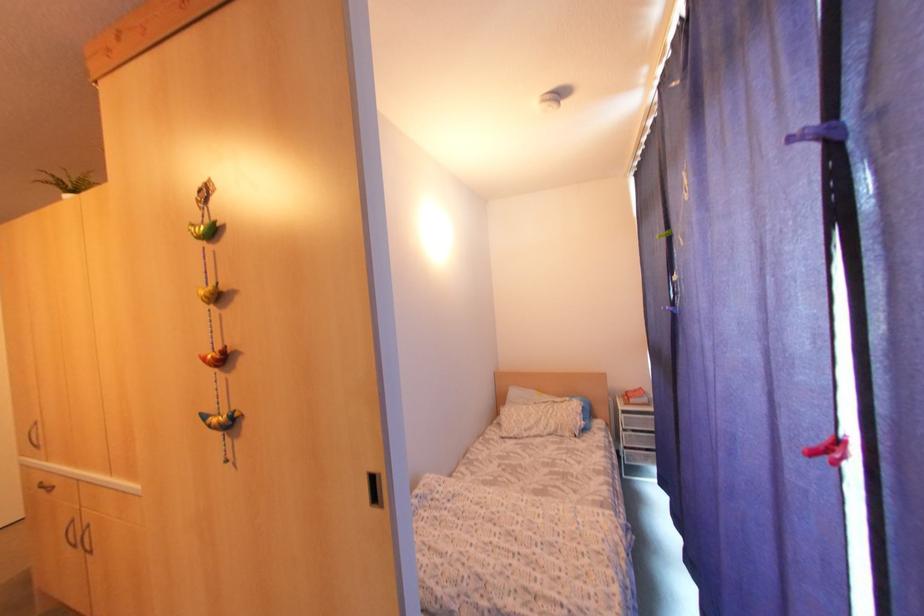
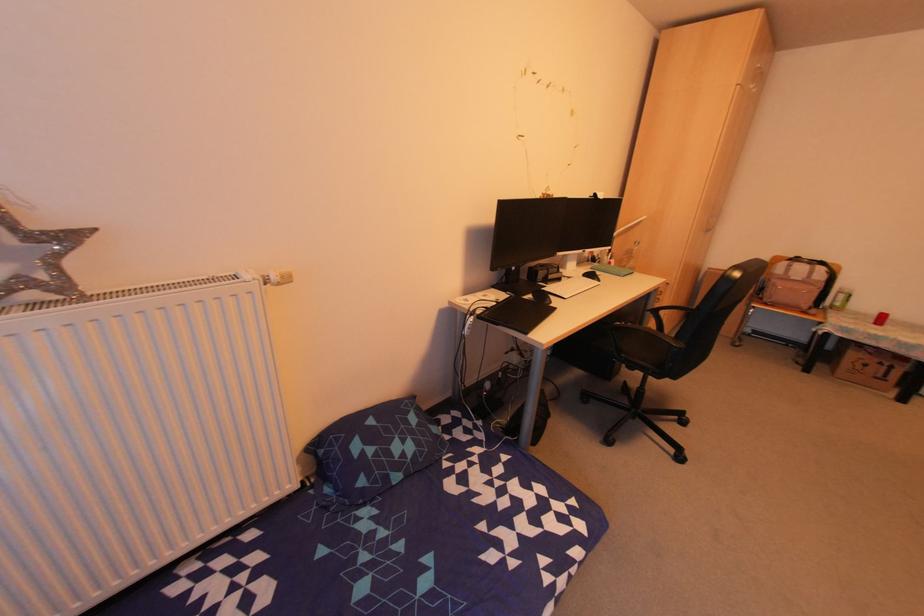
How did the camera likely rotate?

The camera's rotation is toward left-down.